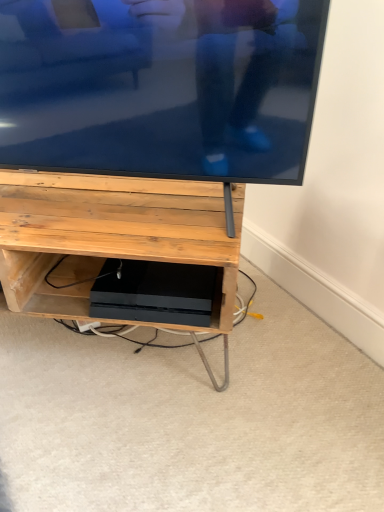
Question: Is matte black tv at upper center shorter than black matte console at center?

Choices:
 (A) no
 (B) yes

Answer: (A)

Question: Is matte black tv at upper center directly adjacent to black matte console at center?

Choices:
 (A) yes
 (B) no

Answer: (B)

Question: From a real-world perspective, is matte black tv at upper center positioned under black matte console at center based on gravity?

Choices:
 (A) yes
 (B) no

Answer: (B)

Question: Is the position of matte black tv at upper center less distant than that of black matte console at center?

Choices:
 (A) no
 (B) yes

Answer: (B)

Question: Is black matte console at center a part of matte black tv at upper center?

Choices:
 (A) yes
 (B) no

Answer: (B)

Question: Does matte black tv at upper center have a lesser width compared to black matte console at center?

Choices:
 (A) yes
 (B) no

Answer: (A)

Question: Would you say black matte console at center is outside matte black tv at upper center?

Choices:
 (A) yes
 (B) no

Answer: (A)

Question: Can you confirm if black matte console at center is bigger than matte black tv at upper center?

Choices:
 (A) no
 (B) yes

Answer: (A)

Question: From the image's perspective, would you say black matte console at center is positioned over matte black tv at upper center?

Choices:
 (A) no
 (B) yes

Answer: (A)

Question: Is black matte console at center far from matte black tv at upper center?

Choices:
 (A) yes
 (B) no

Answer: (B)

Question: Is the depth of black matte console at center less than that of matte black tv at upper center?

Choices:
 (A) no
 (B) yes

Answer: (A)

Question: Could you tell me if black matte console at center is facing matte black tv at upper center?

Choices:
 (A) yes
 (B) no

Answer: (B)

Question: Is matte black tv at upper center oriented away from matte wood shelf at center?

Choices:
 (A) yes
 (B) no

Answer: (B)